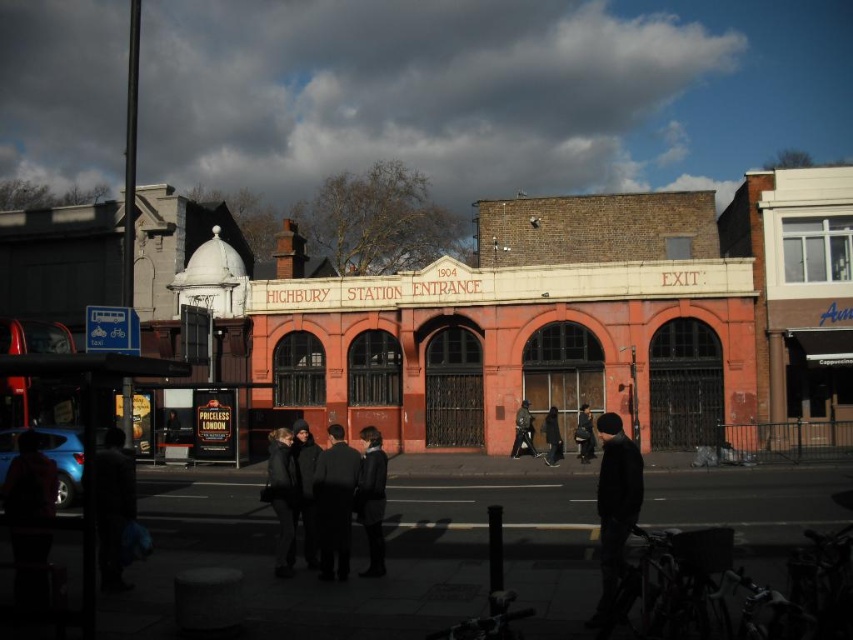
Does black matte jacket at center have a smaller size compared to black leather coat at center?

No.

Can you confirm if black matte jacket at center is thinner than black leather coat at center?

In fact, black matte jacket at center might be wider than black leather coat at center.

Does point (625, 484) lie behind point (375, 564)?

No, (625, 484) is closer to viewer.

Locate an element on the screen. black matte jacket at center is located at coordinates (614, 506).

Measure the distance from dark gray coat at lower left to dark gray fabric jacket at center.

33.52 meters

Does dark gray coat at lower left appear over dark gray fabric jacket at center?

Actually, dark gray coat at lower left is below dark gray fabric jacket at center.

Is point (115, 580) farther from viewer compared to point (524, 445)?

No, (115, 580) is in front of (524, 445).

I want to click on dark gray coat at lower left, so click(113, 506).

Can you confirm if dark gray wool coat at center is shorter than dark gray jacket at center?

Incorrect, dark gray wool coat at center's height does not fall short of dark gray jacket at center's.

Is the position of dark gray wool coat at center less distant than that of dark gray jacket at center?

Yes.

At what (x,y) coordinates should I click in order to perform the action: click on dark gray wool coat at center. Please return your answer as a coordinate pair (x, y). The height and width of the screenshot is (640, 853). Looking at the image, I should click on (305, 486).